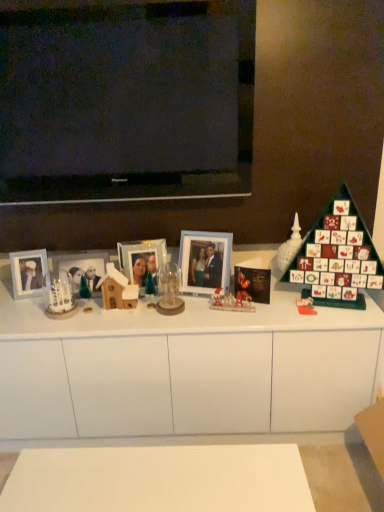
Question: Considering their positions, is clear glass ornament at center, which is counted as the second toy, starting from the left, located in front of or behind white matte cabinet at center?

Choices:
 (A) front
 (B) behind

Answer: (B)

Question: From a real-world perspective, is clear glass ornament at center, positioned as the fourth toy in right-to-left order, positioned above or below white matte cabinet at center?

Choices:
 (A) below
 (B) above

Answer: (B)

Question: Considering the real-world distances, which object is farthest from the matte silver picture frame at left, which is counted as the fourth picture frame, starting from the right?

Choices:
 (A) wooden house at center, arranged as the fifth toy when viewed from the right
 (B) green matte advent calendar at right
 (C) white matte cabinet at center
 (D) clear glass ornament at center, positioned as the fourth toy in right-to-left order
 (E) white frosted glass candle holder at left

Answer: (B)

Question: Which object is the farthest from the matte glass photo frame at center, the first picture frame in the right-to-left sequence?

Choices:
 (A) black glossy television at upper center
 (B) metallic silver picture frame at center, acting as the 2th picture frame starting from the right
 (C) matte glass picture frame at center, the 3th picture frame positioned from the right
 (D) matte plastic toy at right, arranged as the first toy when viewed from the right
 (E) green matte advent calendar at right

Answer: (A)